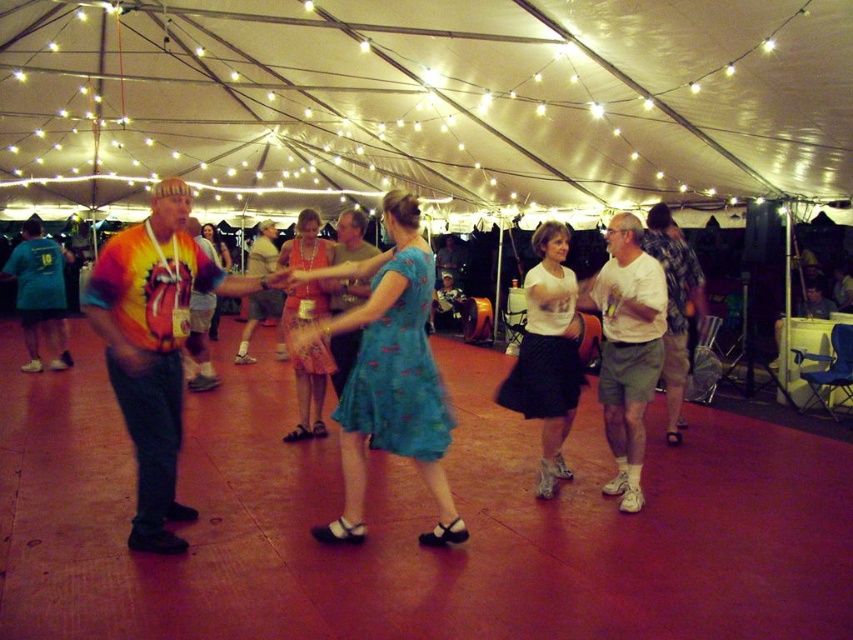
You are standing at the entrance of the tent and want to find the blue satin dress at center. According to the coordinates provided, in which direction should you look to locate it?

The blue satin dress at center is located at coordinates point (389, 374), so you should look towards the center of the tent slightly to the right and a bit forward from the entrance.